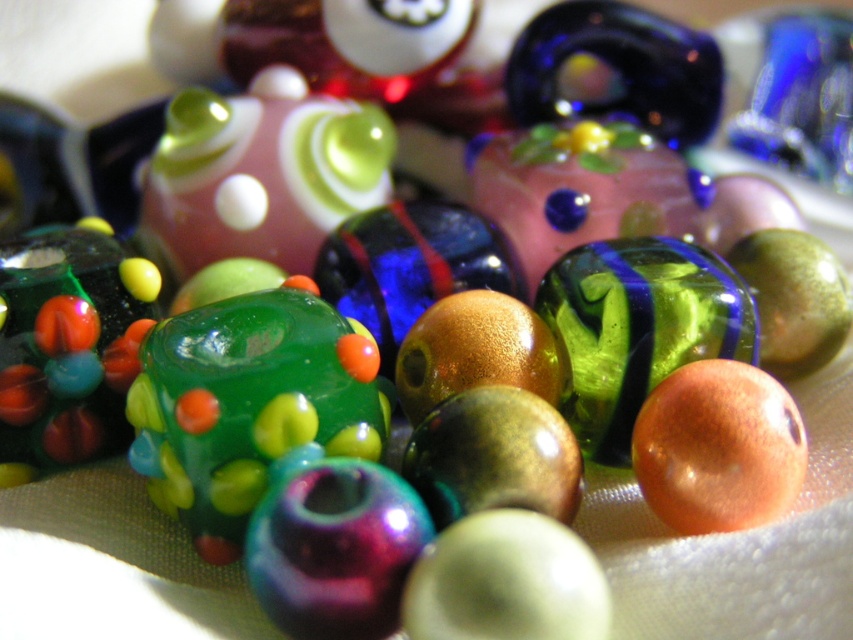
Question: Which object is the closest to the matte glass bead at center?

Choices:
 (A) green glass bead at center
 (B) green glossy bead at center-left

Answer: (B)

Question: Is matte glass bead at center above green glass bead at center?

Choices:
 (A) no
 (B) yes

Answer: (B)

Question: Does green glossy bead at center-left have a greater width compared to matte orange bead at center?

Choices:
 (A) no
 (B) yes

Answer: (B)

Question: Which of the following is the farthest from the observer?

Choices:
 (A) (340, 380)
 (B) (688, 385)

Answer: (B)

Question: Which of the following is the farthest from the observer?

Choices:
 (A) green glossy bead at center-left
 (B) green glass bead at center
 (C) matte orange bead at center

Answer: (B)

Question: Is green glossy bead at center to the right of green glossy bead at center-left from the viewer's perspective?

Choices:
 (A) no
 (B) yes

Answer: (B)